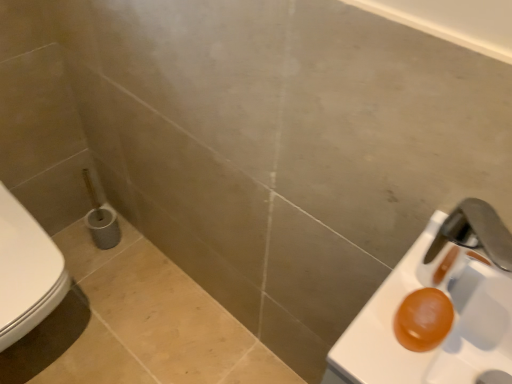
What is the approximate width of white glossy toilet at left?

21.29 inches.

Image resolution: width=512 pixels, height=384 pixels. I want to click on white glossy toilet at left, so click(26, 272).

Consider the image. Measure the distance between white glossy toilet at left and camera.

They are 36.00 inches apart.

What do you see at coordinates (26, 272) in the screenshot? The height and width of the screenshot is (384, 512). I see `white glossy toilet at left` at bounding box center [26, 272].

The image size is (512, 384). I want to click on orange translucent soap at right, so click(437, 309).

What do you see at coordinates (437, 309) in the screenshot?
I see `orange translucent soap at right` at bounding box center [437, 309].

This screenshot has width=512, height=384. Identify the location of white glossy toilet at left. point(26,272).

Can you confirm if white glossy toilet at left is positioned to the left of orange translucent soap at right?

Correct, you'll find white glossy toilet at left to the left of orange translucent soap at right.

From the picture: Is white glossy toilet at left in front of orange translucent soap at right?

No, it is not.

Which point is more forward, (10,325) or (431,304)?

The point (431,304) is closer.

From the image's perspective, is white glossy toilet at left above or below orange translucent soap at right?

white glossy toilet at left is situated higher than orange translucent soap at right in the image.

From a real-world perspective, which is physically below, white glossy toilet at left or orange translucent soap at right?

In real-world perspective, white glossy toilet at left is lower.

Which object is wider, white glossy toilet at left or orange translucent soap at right?

Wider between the two is white glossy toilet at left.

Based on the photo, is white glossy toilet at left taller or shorter than orange translucent soap at right?

In the image, white glossy toilet at left appears to be taller than orange translucent soap at right.

Looking at the image, does white glossy toilet at left seem bigger or smaller compared to orange translucent soap at right?

Clearly, white glossy toilet at left is larger in size than orange translucent soap at right.

Would you say orange translucent soap at right is part of white glossy toilet at left's contents?

No.

Would you say white glossy toilet at left is a long distance from orange translucent soap at right?

Actually, white glossy toilet at left and orange translucent soap at right are a little close together.

Is white glossy toilet at left turned away from orange translucent soap at right?

white glossy toilet at left is not turned away from orange translucent soap at right.

Identify the location of toilet on the left of orange translucent soap at right. (26, 272).

Is orange translucent soap at right to the left or to the right of white glossy toilet at left in the image?

Clearly, orange translucent soap at right is on the right of white glossy toilet at left in the image.

In the scene shown: Considering their positions, is orange translucent soap at right located in front of or behind white glossy toilet at left?

In the image, orange translucent soap at right appears in front of white glossy toilet at left.

Between point (444, 238) and point (62, 259), which one is positioned behind?

The point (62, 259) is farther.

From the image's perspective, does orange translucent soap at right appear higher than white glossy toilet at left?

No.

From a real-world perspective, is orange translucent soap at right positioned under white glossy toilet at left based on gravity?

No, from a real-world perspective, orange translucent soap at right is not under white glossy toilet at left.

Considering the sizes of orange translucent soap at right and white glossy toilet at left in the image, is orange translucent soap at right wider or thinner than white glossy toilet at left?

Considering their sizes, orange translucent soap at right looks slimmer than white glossy toilet at left.

Considering the sizes of objects orange translucent soap at right and white glossy toilet at left in the image provided, who is taller, orange translucent soap at right or white glossy toilet at left?

white glossy toilet at left.

Who is smaller, orange translucent soap at right or white glossy toilet at left?

orange translucent soap at right is smaller.

Is white glossy toilet at left a part of orange translucent soap at right?

No, white glossy toilet at left is not inside orange translucent soap at right.

In the scene shown: Are orange translucent soap at right and white glossy toilet at left far apart?

That's not correct — orange translucent soap at right is a little close to white glossy toilet at left.

Is orange translucent soap at right turned away from white glossy toilet at left?

No, white glossy toilet at left is not at the back of orange translucent soap at right.

Where is `sink above the white glossy toilet at left (from a real-world perspective)`? The image size is (512, 384). sink above the white glossy toilet at left (from a real-world perspective) is located at coordinates (437, 309).

Locate an element on the screen. Image resolution: width=512 pixels, height=384 pixels. sink that is in front of the white glossy toilet at left is located at coordinates (437, 309).

The image size is (512, 384). Identify the location of toilet above the orange translucent soap at right (from the image's perspective). (26, 272).